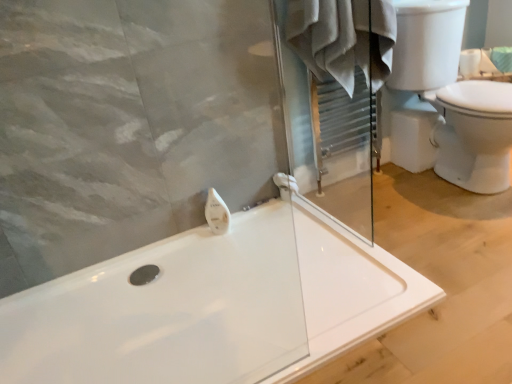
Question: Which direction should I rotate to look at white glossy soap dispenser at upper center?

Choices:
 (A) left
 (B) right

Answer: (A)

Question: Considering the relative sizes of white plastic towel bar at center and white glossy soap dispenser at upper center in the image provided, is white plastic towel bar at center smaller than white glossy soap dispenser at upper center?

Choices:
 (A) yes
 (B) no

Answer: (B)

Question: Considering the relative positions of white plastic towel bar at center and white glossy soap dispenser at upper center in the image provided, is white plastic towel bar at center to the left of white glossy soap dispenser at upper center from the viewer's perspective?

Choices:
 (A) yes
 (B) no

Answer: (B)

Question: Can we say white plastic towel bar at center lies outside white glossy soap dispenser at upper center?

Choices:
 (A) yes
 (B) no

Answer: (A)

Question: Is white plastic towel bar at center in front of white glossy soap dispenser at upper center?

Choices:
 (A) yes
 (B) no

Answer: (B)

Question: Are white plastic towel bar at center and white glossy soap dispenser at upper center far apart?

Choices:
 (A) yes
 (B) no

Answer: (B)

Question: Could white glossy soap dispenser at upper center be considered to be inside white plastic towel bar at center?

Choices:
 (A) yes
 (B) no

Answer: (B)

Question: Can you confirm if white cotton bathrobe at upper center is wider than white glossy toilet at right?

Choices:
 (A) yes
 (B) no

Answer: (B)

Question: From the image's perspective, is white cotton bathrobe at upper center under white glossy toilet at right?

Choices:
 (A) yes
 (B) no

Answer: (B)

Question: Is white cotton bathrobe at upper center behind white glossy toilet at right?

Choices:
 (A) yes
 (B) no

Answer: (A)

Question: Is white glossy toilet at right surrounded by white cotton bathrobe at upper center?

Choices:
 (A) no
 (B) yes

Answer: (A)

Question: Does white cotton bathrobe at upper center have a lesser height compared to white glossy toilet at right?

Choices:
 (A) yes
 (B) no

Answer: (A)

Question: Is white cotton bathrobe at upper center smaller than white glossy toilet at right?

Choices:
 (A) no
 (B) yes

Answer: (B)

Question: Does white cotton bathrobe at upper center come behind white plastic towel bar at center?

Choices:
 (A) no
 (B) yes

Answer: (A)